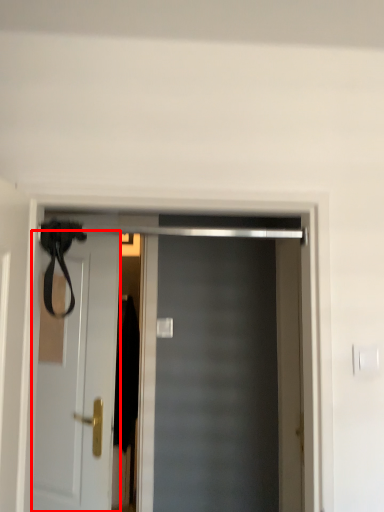
Question: In this image, where is door (annotated by the red box) located relative to door?

Choices:
 (A) right
 (B) left

Answer: (B)